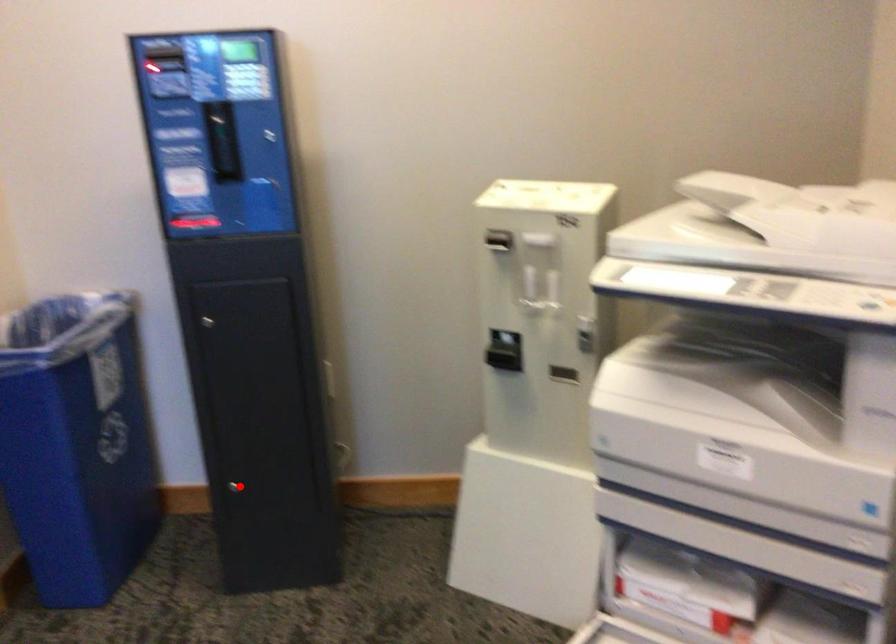
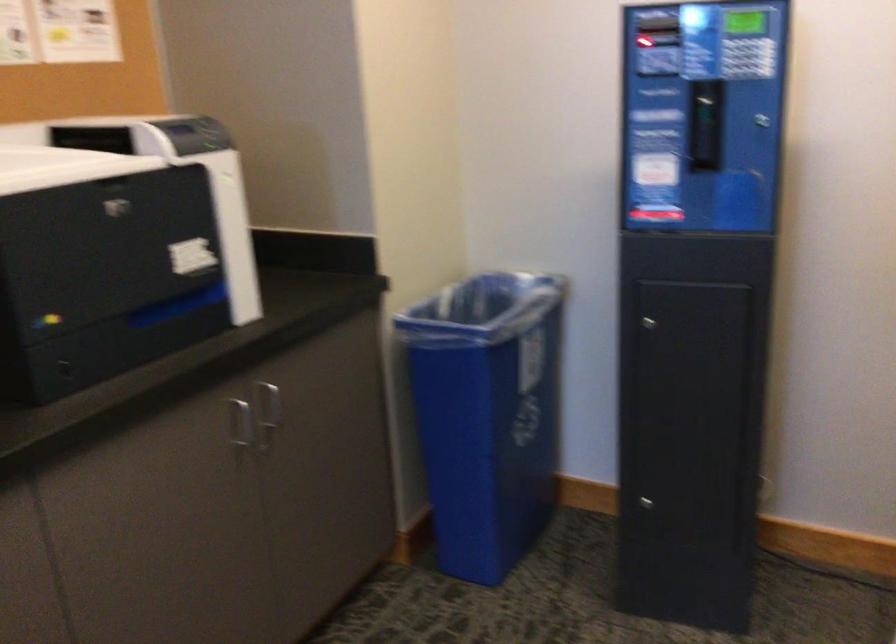
Question: A red point is marked in image1. In image2, is the corresponding 3D point closer to the camera or farther? Reply with the corresponding letter.

Choices:
 (A) The corresponding 3D point is closer.
 (B) The corresponding 3D point is farther.

Answer: (A)